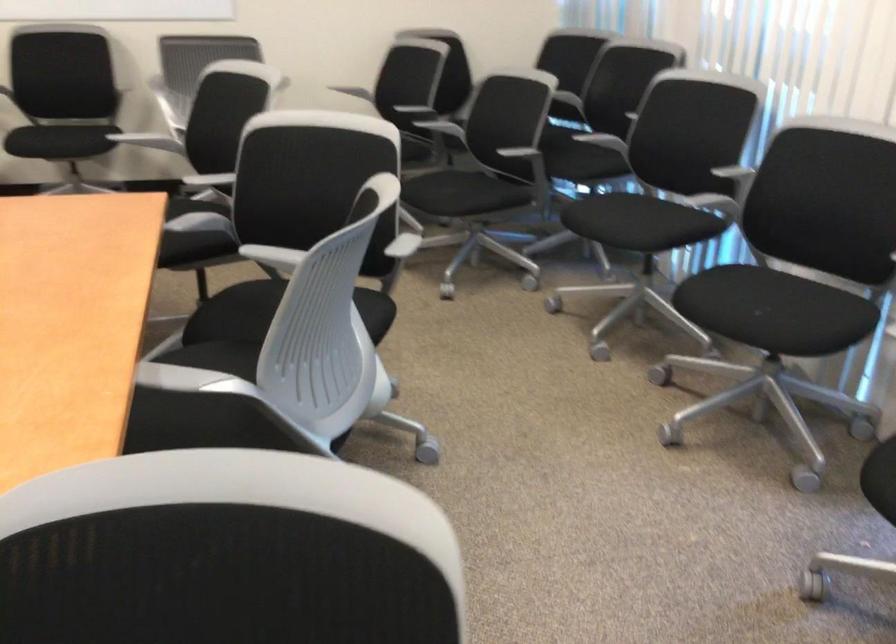
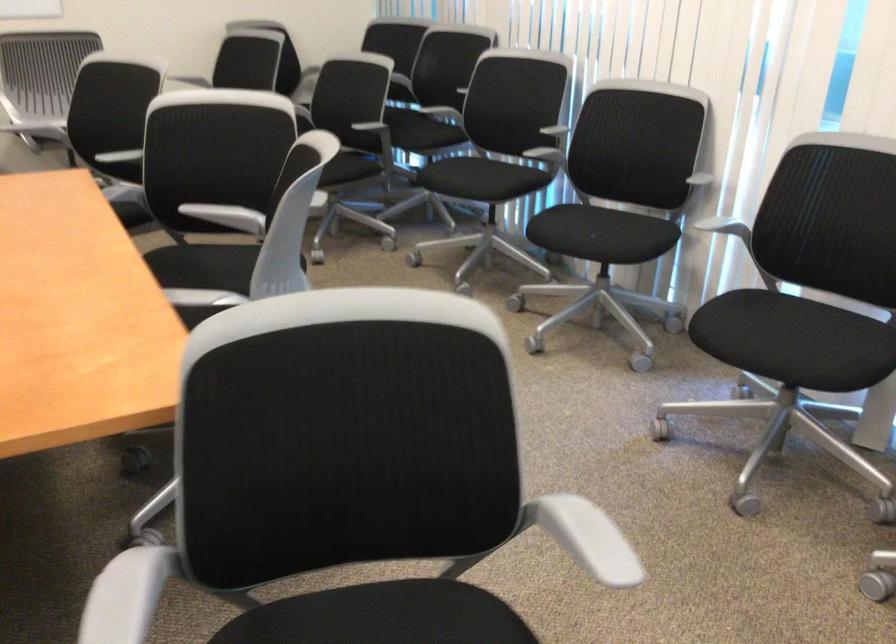
Question: How did the camera likely rotate?

Choices:
 (A) Left
 (B) Right
 (C) Up
 (D) Down

Answer: (B)